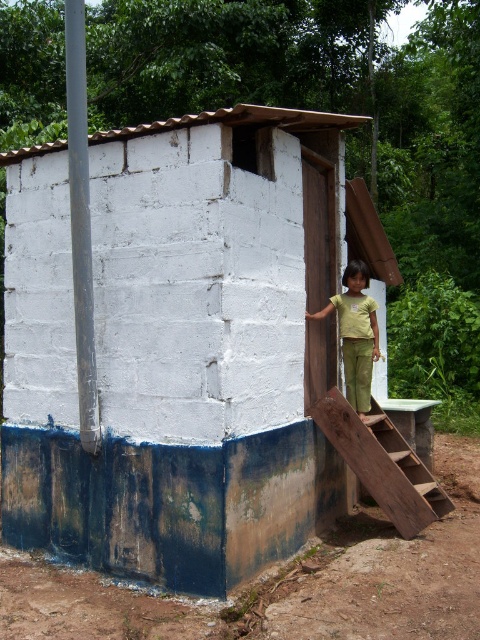
Who is positioned more to the left, wooden stairs at right or green cotton pants at right?

green cotton pants at right is more to the left.

Is point (368, 436) positioned after point (342, 326)?

No, it is not.

This screenshot has height=640, width=480. What do you see at coordinates (383, 461) in the screenshot?
I see `wooden stairs at right` at bounding box center [383, 461].

You are a GUI agent. You are given a task and a screenshot of the screen. Output one action in this format:
    pyautogui.click(x=<x>, y=<y>)
    Task: Click on the wooden stairs at right
    This screenshot has height=640, width=480.
    Given the screenshot: What is the action you would take?
    pyautogui.click(x=383, y=461)

Can you confirm if white painted concrete hut at center is smaller than green cotton pants at right?

No, white painted concrete hut at center is not smaller than green cotton pants at right.

Is white painted concrete hut at center wider than green cotton pants at right?

Yes.

Image resolution: width=480 pixels, height=640 pixels. Identify the location of white painted concrete hut at center. (182, 342).

Is white painted concrete hut at center shorter than wooden stairs at right?

No.

Is white painted concrete hut at center to the left of wooden stairs at right from the viewer's perspective?

Indeed, white painted concrete hut at center is positioned on the left side of wooden stairs at right.

What do you see at coordinates (182, 342) in the screenshot?
I see `white painted concrete hut at center` at bounding box center [182, 342].

At what (x,y) coordinates should I click in order to perform the action: click on white painted concrete hut at center. Please return your answer as a coordinate pair (x, y). Looking at the image, I should click on (182, 342).